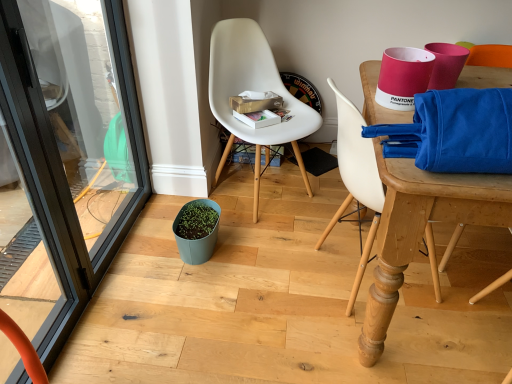
Question: Is black glass screen door at left not inside white plastic chair at upper right, marked as the 1th chair in a right-to-left arrangement?

Choices:
 (A) no
 (B) yes

Answer: (B)

Question: Is black glass screen door at left wider than white plastic chair at upper right, marked as the 1th chair in a right-to-left arrangement?

Choices:
 (A) no
 (B) yes

Answer: (A)

Question: Considering the relative positions of black glass screen door at left and white plastic chair at upper right, the 2th chair viewed from the left, in the image provided, is black glass screen door at left to the left of white plastic chair at upper right, the 2th chair viewed from the left, from the viewer's perspective?

Choices:
 (A) no
 (B) yes

Answer: (B)

Question: Is black glass screen door at left oriented away from white plastic chair at upper right, marked as the 1th chair in a right-to-left arrangement?

Choices:
 (A) yes
 (B) no

Answer: (B)

Question: Is black glass screen door at left at the right side of white plastic chair at upper right, the 2th chair viewed from the left?

Choices:
 (A) yes
 (B) no

Answer: (B)

Question: Is point (216, 241) closer or farther from the camera than point (294, 137)?

Choices:
 (A) farther
 (B) closer

Answer: (A)

Question: Considering the positions of teal matte flowerpot at center and white plastic chair at center, which is the second chair from right to left, in the image, is teal matte flowerpot at center taller or shorter than white plastic chair at center, which is the second chair from right to left,?

Choices:
 (A) tall
 (B) short

Answer: (B)

Question: In terms of size, does teal matte flowerpot at center appear bigger or smaller than white plastic chair at center, which is the second chair from right to left?

Choices:
 (A) big
 (B) small

Answer: (B)

Question: In the image, is teal matte flowerpot at center on the left side or the right side of white plastic chair at center, which is the second chair from right to left?

Choices:
 (A) right
 (B) left

Answer: (B)

Question: In the image, is black glass screen door at left positioned in front of or behind white plastic chair at upper right, the 2th chair viewed from the left?

Choices:
 (A) behind
 (B) front

Answer: (B)

Question: From the image's perspective, is black glass screen door at left above or below white plastic chair at upper right, marked as the 1th chair in a right-to-left arrangement?

Choices:
 (A) below
 (B) above

Answer: (B)

Question: Considering the relative positions of black glass screen door at left and white plastic chair at upper right, the 2th chair viewed from the left, in the image provided, is black glass screen door at left to the left or to the right of white plastic chair at upper right, the 2th chair viewed from the left,?

Choices:
 (A) right
 (B) left

Answer: (B)

Question: Considering the positions of black glass screen door at left and white plastic chair at upper right, marked as the 1th chair in a right-to-left arrangement, in the image, is black glass screen door at left wider or thinner than white plastic chair at upper right, marked as the 1th chair in a right-to-left arrangement,?

Choices:
 (A) thin
 (B) wide

Answer: (A)

Question: Considering the positions of point (47, 172) and point (302, 124), is point (47, 172) closer or farther from the camera than point (302, 124)?

Choices:
 (A) farther
 (B) closer

Answer: (B)

Question: From the image's perspective, relative to white plastic chair at center, which is the second chair from right to left, is black glass screen door at left above or below?

Choices:
 (A) above
 (B) below

Answer: (B)